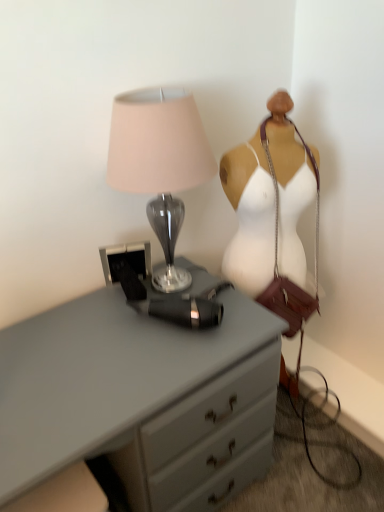
Where is `matte gray chest of drawers at center`? The image size is (384, 512). matte gray chest of drawers at center is located at coordinates (141, 399).

Where is `matte gray chest of drawers at center`? The image size is (384, 512). matte gray chest of drawers at center is located at coordinates (141, 399).

What's the angular difference between satin gray lamp at upper left and matte gray chest of drawers at center's facing directions?

0.000243 degrees.

Can you confirm if satin gray lamp at upper left is wider than matte gray chest of drawers at center?

In fact, satin gray lamp at upper left might be narrower than matte gray chest of drawers at center.

Which of these two, satin gray lamp at upper left or matte gray chest of drawers at center, is smaller?

Smaller between the two is satin gray lamp at upper left.

From the image's perspective, which object appears higher, satin gray lamp at upper left or matte gray chest of drawers at center?

From the image's view, satin gray lamp at upper left is above.

From the image's perspective, is white fabric mannequin at right located beneath satin gray lamp at upper left?

Indeed, from the image's perspective, white fabric mannequin at right is shown beneath satin gray lamp at upper left.

Is white fabric mannequin at right touching satin gray lamp at upper left?

They are not placed beside each other.

Is white fabric mannequin at right closer to the viewer compared to satin gray lamp at upper left?

No, the depth of white fabric mannequin at right is greater than that of satin gray lamp at upper left.

How different are the orientations of white fabric mannequin at right and satin gray lamp at upper left in degrees?

There is a 21.4-degree angle between the facing directions of white fabric mannequin at right and satin gray lamp at upper left.

Are matte gray chest of drawers at center and white fabric mannequin at right beside each other?

matte gray chest of drawers at center and white fabric mannequin at right are clearly separated.

Is matte gray chest of drawers at center situated inside white fabric mannequin at right or outside?

matte gray chest of drawers at center exists outside the volume of white fabric mannequin at right.

From the image's perspective, is matte gray chest of drawers at center located above white fabric mannequin at right?

No, from the image's perspective, matte gray chest of drawers at center is not over white fabric mannequin at right.

Does matte gray chest of drawers at center appear on the right side of white fabric mannequin at right?

Incorrect, matte gray chest of drawers at center is not on the right side of white fabric mannequin at right.

Does white fabric mannequin at right have a greater height compared to matte gray chest of drawers at center?

Indeed, white fabric mannequin at right has a greater height compared to matte gray chest of drawers at center.

The image size is (384, 512). In order to click on mannequin above the matte gray chest of drawers at center (from a real-world perspective) in this screenshot , I will do `click(271, 214)`.

From the picture: From the image's perspective, would you say white fabric mannequin at right is positioned over matte gray chest of drawers at center?

Yes, from the image's perspective, white fabric mannequin at right is over matte gray chest of drawers at center.

In the scene shown: Is white fabric mannequin at right facing towards matte gray chest of drawers at center?

No.

Who is shorter, satin gray lamp at upper left or white fabric mannequin at right?

Standing shorter between the two is satin gray lamp at upper left.

Is satin gray lamp at upper left located outside white fabric mannequin at right?

That's correct, satin gray lamp at upper left is outside of white fabric mannequin at right.

Does satin gray lamp at upper left appear on the right side of white fabric mannequin at right?

In fact, satin gray lamp at upper left is to the left of white fabric mannequin at right.

Considering their positions, is satin gray lamp at upper left located in front of or behind white fabric mannequin at right?

satin gray lamp at upper left is in front of white fabric mannequin at right.

In the scene shown: Considering the sizes of matte gray chest of drawers at center and satin gray lamp at upper left in the image, is matte gray chest of drawers at center bigger or smaller than satin gray lamp at upper left?

Considering their sizes, matte gray chest of drawers at center takes up more space than satin gray lamp at upper left.

Looking at this image, is the depth of matte gray chest of drawers at center less than that of satin gray lamp at upper left?

Yes, it is.

Is matte gray chest of drawers at center looking in the opposite direction of satin gray lamp at upper left?

No, satin gray lamp at upper left is not at the back of matte gray chest of drawers at center.

Which is less distant, (190, 360) or (165, 123)?

Point (190, 360) appears to be farther away from the viewer than point (165, 123).

At what (x,y) coordinates should I click in order to perform the action: click on chest of drawers that is on the left side of satin gray lamp at upper left. Please return your answer as a coordinate pair (x, y). This screenshot has height=512, width=384. Looking at the image, I should click on (141, 399).

Locate an element on the screen. mannequin that is on the right side of satin gray lamp at upper left is located at coordinates (271, 214).

Looking at this image, estimate the real-world distances between objects in this image. Which object is further from white fabric mannequin at right, satin gray lamp at upper left or matte gray chest of drawers at center?

matte gray chest of drawers at center is positioned further to the anchor white fabric mannequin at right.

From the image, which object appears to be nearer to matte gray chest of drawers at center, white fabric mannequin at right or satin gray lamp at upper left?

Based on the image, satin gray lamp at upper left appears to be nearer to matte gray chest of drawers at center.

When comparing their distances from white fabric mannequin at right, does matte gray chest of drawers at center or satin gray lamp at upper left seem closer?

satin gray lamp at upper left is positioned closer to the anchor white fabric mannequin at right.

Based on their spatial positions, is matte gray chest of drawers at center or white fabric mannequin at right further from satin gray lamp at upper left?

Based on the image, matte gray chest of drawers at center appears to be further to satin gray lamp at upper left.

Which object lies nearer to the anchor point matte gray chest of drawers at center, satin gray lamp at upper left or white fabric mannequin at right?

The object closer to matte gray chest of drawers at center is satin gray lamp at upper left.

From the image, which object appears to be farther from satin gray lamp at upper left, white fabric mannequin at right or matte gray chest of drawers at center?

matte gray chest of drawers at center.

Locate an element on the screen. The height and width of the screenshot is (512, 384). mannequin between satin gray lamp at upper left and matte gray chest of drawers at center in the up-down direction is located at coordinates (271, 214).